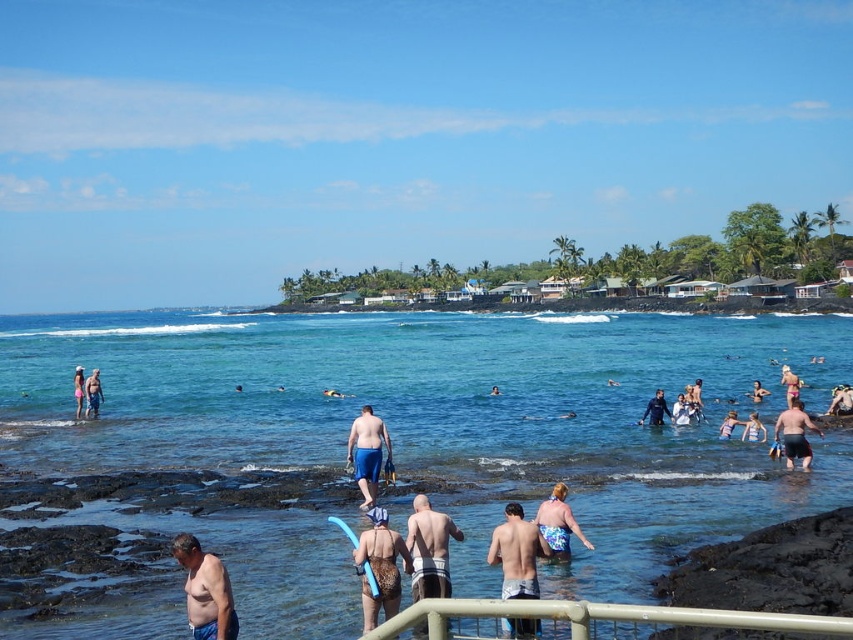
You are a photographer trying to capture a clear shot of the light pink swimsuit at center and the pink fabric bikini at center. Since you want both subjects to be visible, which one should you focus on to ensure it takes up more of the frame?

You should focus on the pink fabric bikini at center because it occupies more space than the light pink swimsuit at center, making it easier to capture clearly in the frame.

You are standing at the viewing platform indicated by the railing at the bottom edge of the image. You notice a person with smooth tan skin at center. Based on their position in the scene, which direction should you look to see them?

The smooth tan skin at center is located at point 0.627 on the x and 0.987 on the y coordinate, which is towards the lower central area of the image. Since you are at the railing on the very bottom edge, you would need to look upwards slightly to the center to see the person with smooth tan skin at center.

You are a photographer positioned at the railing and want to capture both the blue fabric swimsuit at center and the light pink swimsuit at center in a single shot. Which swimsuit should you adjust your camera to focus on first to ensure both are in frame?

You should focus on the blue fabric swimsuit at center first because it is positioned to the left of the light pink swimsuit at center, so adjusting focus starting from the left ensures both are included in the frame.